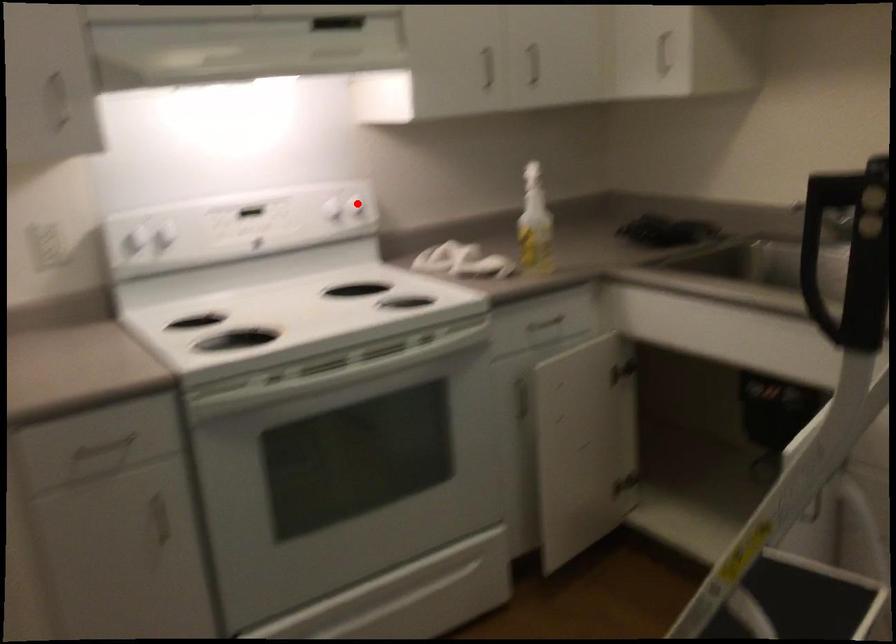
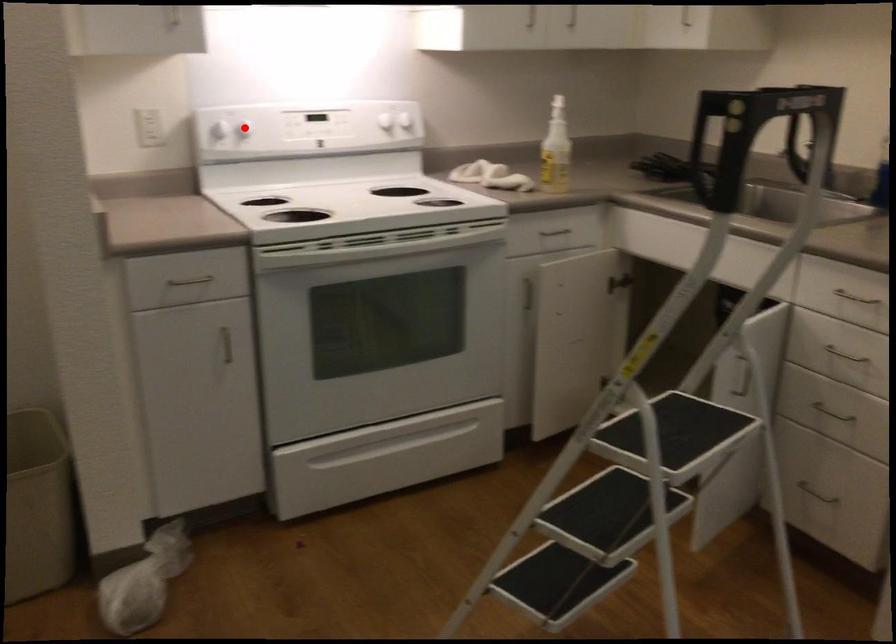
I am providing you with two images of the same scene from different viewpoints. A red point is marked on the first image and another point is marked on the second image. Does the point marked in image1 correspond to the same location as the one in image2?

No